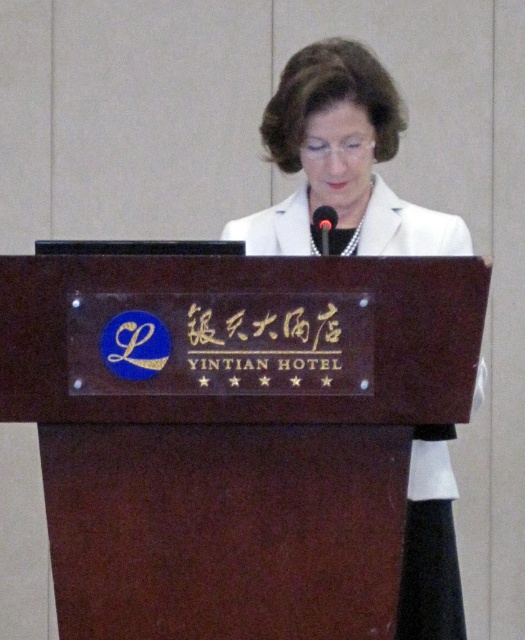
You are standing at the center of the stage and need to walk to the brown polished wood podium at center. In which direction should you move?

The brown polished wood podium at center is located at point 0.714 on the x axis and 0.450 on the y axis, so you should move to the right and forward to reach it.

You are an event planner setting up for a presentation. You need to place a name tag on the podium so it doesn t block the text. Where should you place the name tag on the brown polished wood podium at center relative to the black glossy text at center?

Since the brown polished wood podium at center is bigger than the black glossy text at center, you can place the name tag on the side or edge of the podium away from the black glossy text at center to ensure it doesn t cover the text.

You are a photographer setting up for a photo shoot. You need to position a camera 30 inches away from the brown polished wood podium at center to capture it clearly. Can you place the camera at the current position of the white glossy coat at center without moving it?

The brown polished wood podium at center and white glossy coat at center are 28.80 inches apart from each other. Since the required distance is 30 inches, placing the camera at the white glossy coat at center would be 1.2 inches too close.